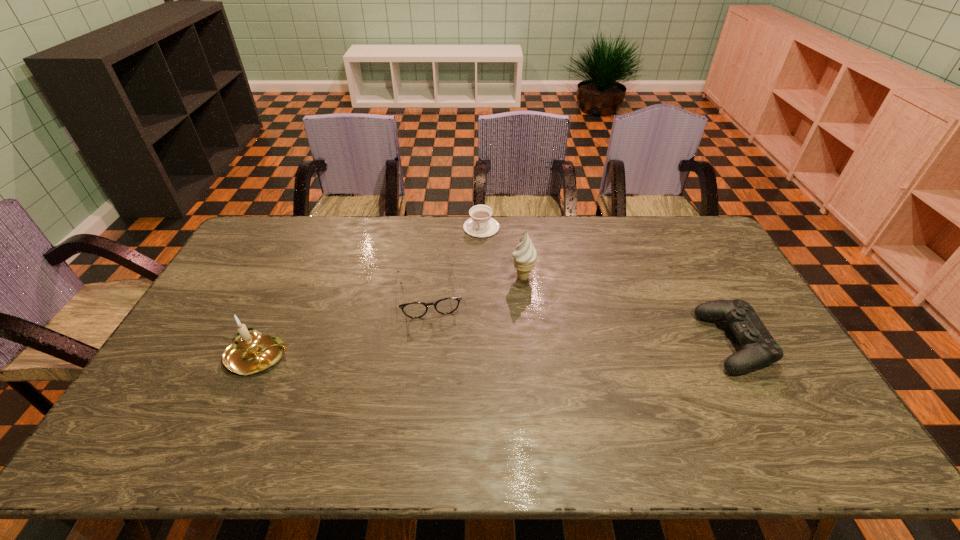
Locate an element on the screen. The image size is (960, 540). free spot on the desktop that is between the leftmost object and the control and is positioned on the front-facing side of the second object from right to left is located at coordinates (443, 351).

Locate an element on the screen. The height and width of the screenshot is (540, 960). vacant space on the desktop that is between the candle holder and the third tallest object and is positioned on the handle side of the teacup is located at coordinates (450, 351).

Find the location of a particular element. vacant space on the desktop that is between the second tallest object and the rightmost object and is positioned through the lenses of the spectacles is located at coordinates (437, 352).